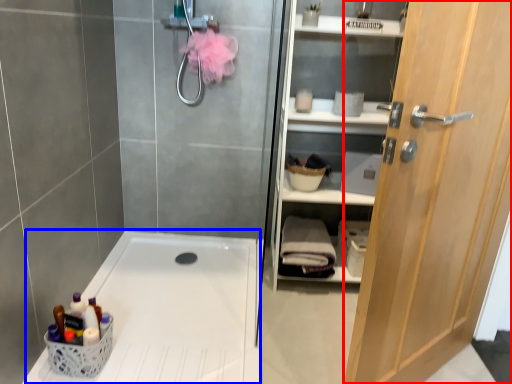
Question: Which point is closer to the camera, door (highlighted by a red box) or bath (highlighted by a blue box)?

Choices:
 (A) door
 (B) bath

Answer: (A)